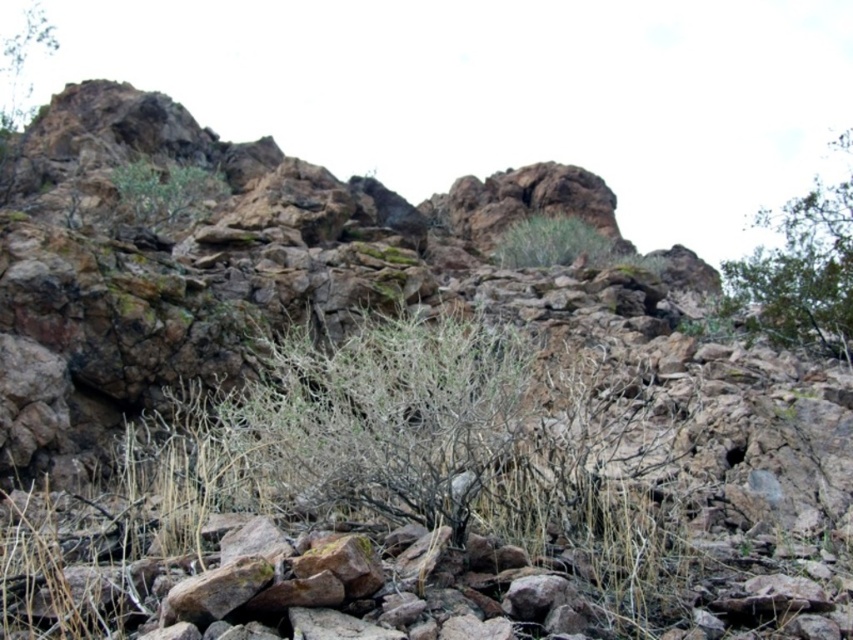
Does green leafy bush at upper center have a lesser height compared to green grass at upper center?

No, green leafy bush at upper center is not shorter than green grass at upper center.

Who is higher up, green leafy bush at upper center or green grass at upper center?

Positioned higher is green leafy bush at upper center.

At what (x,y) coordinates should I click in order to perform the action: click on green leafy bush at upper center. Please return your answer as a coordinate pair (x, y). The image size is (853, 640). Looking at the image, I should click on [163, 193].